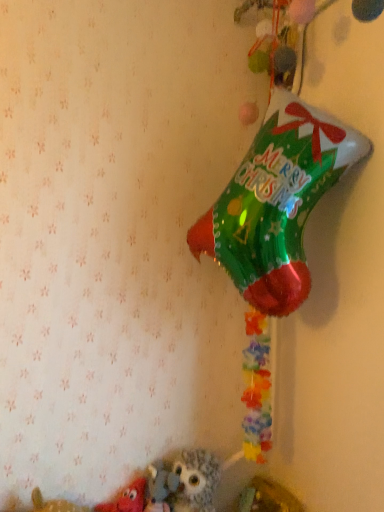
Question: From a real-world perspective, is matte red plush toy at lower left, acting as the 2th toy starting from the right, physically located above or below fluffy gray owl at lower center, the second toy in the left-to-right sequence?

Choices:
 (A) above
 (B) below

Answer: (B)

Question: From their relative heights in the image, would you say matte red plush toy at lower left, acting as the 2th toy starting from the right, is taller or shorter than fluffy gray owl at lower center, the second toy in the left-to-right sequence?

Choices:
 (A) tall
 (B) short

Answer: (B)

Question: Is matte red plush toy at lower left, the first toy viewed from the left, spatially inside fluffy gray owl at lower center, which appears as the 1th toy when viewed from the right, or outside of it?

Choices:
 (A) outside
 (B) inside

Answer: (A)

Question: Is fluffy gray owl at lower center, the second toy in the left-to-right sequence, bigger or smaller than matte red plush toy at lower left, acting as the 2th toy starting from the right?

Choices:
 (A) small
 (B) big

Answer: (B)

Question: From the image's perspective, is fluffy gray owl at lower center, the second toy in the left-to-right sequence, located above or below matte red plush toy at lower left, the first toy viewed from the left?

Choices:
 (A) below
 (B) above

Answer: (B)

Question: Considering their positions, is fluffy gray owl at lower center, which appears as the 1th toy when viewed from the right, located in front of or behind matte red plush toy at lower left, acting as the 2th toy starting from the right?

Choices:
 (A) front
 (B) behind

Answer: (B)

Question: Do you think fluffy gray owl at lower center, which appears as the 1th toy when viewed from the right, is within matte red plush toy at lower left, acting as the 2th toy starting from the right, or outside of it?

Choices:
 (A) inside
 (B) outside

Answer: (B)